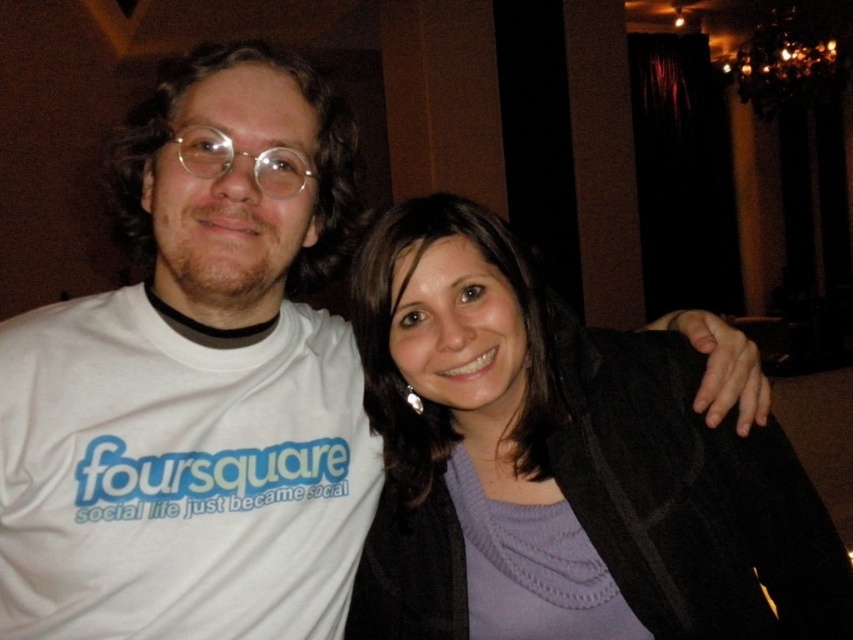
Between white t-shirt at left and purple sweater at center, which one appears on the right side from the viewer's perspective?

From the viewer's perspective, purple sweater at center appears more on the right side.

Between white t-shirt at left and purple sweater at center, which one appears on the left side from the viewer's perspective?

white t-shirt at left is more to the left.

Based on the photo, who is more forward, (248, 129) or (541, 620)?

Positioned in front is point (248, 129).

Identify the location of white t-shirt at left. (196, 384).